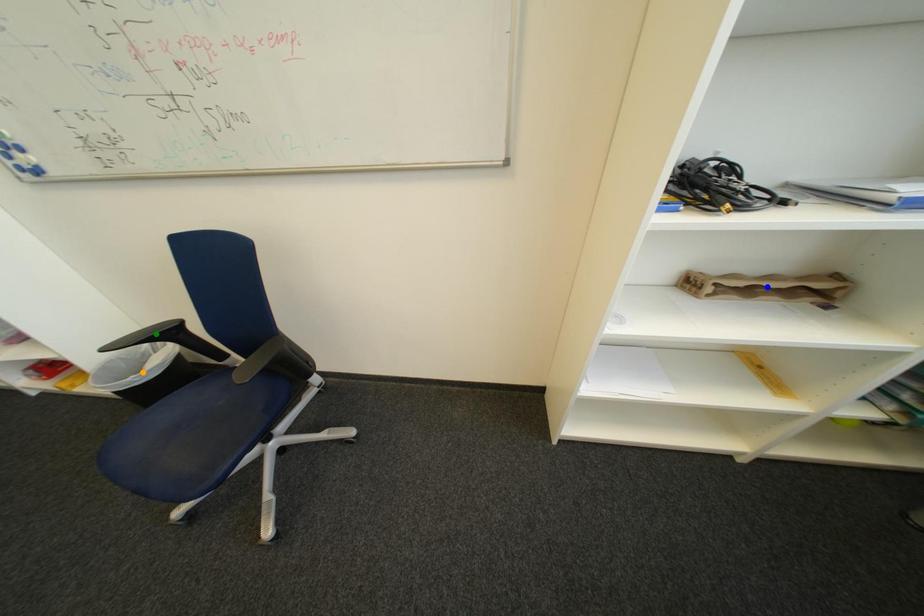
Order these from nearest to farthest:
orange point
blue point
green point

blue point, green point, orange point